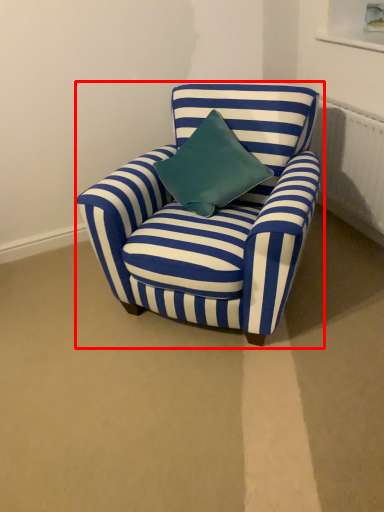
Question: From the image's perspective, where is chair (annotated by the red box) located relative to radiator?

Choices:
 (A) below
 (B) above

Answer: (A)